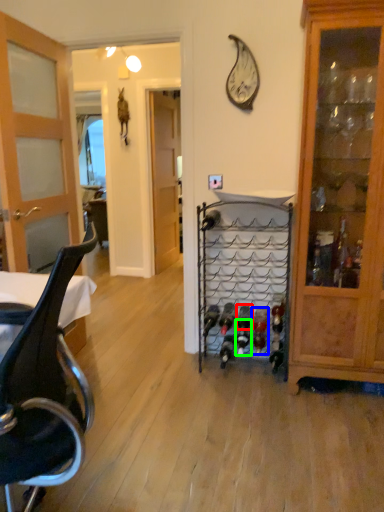
Question: Which object is the closest to the wine bottle (highlighted by a red box)? Choose among these: wine bottle (highlighted by a blue box) or wine bottle (highlighted by a green box).

Choices:
 (A) wine bottle
 (B) wine bottle

Answer: (B)